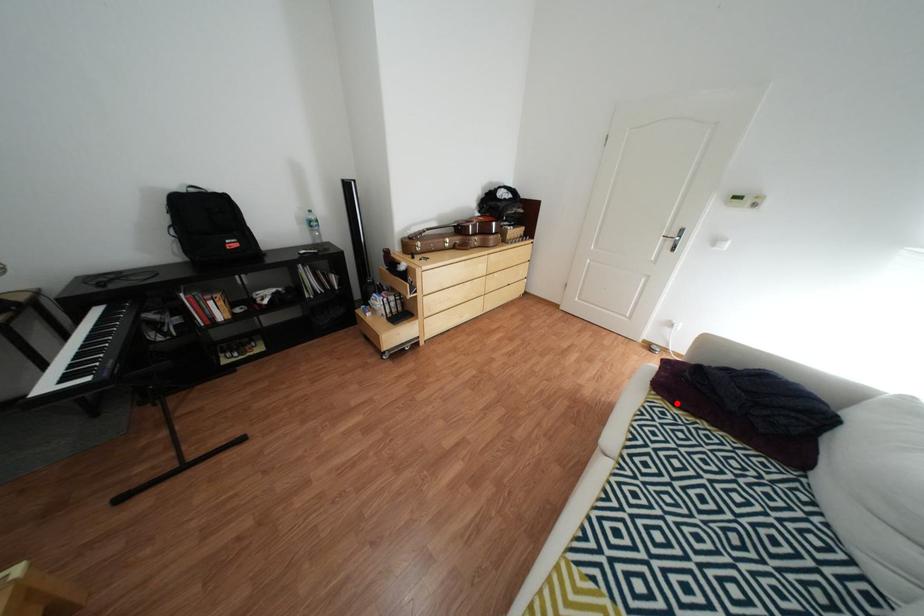
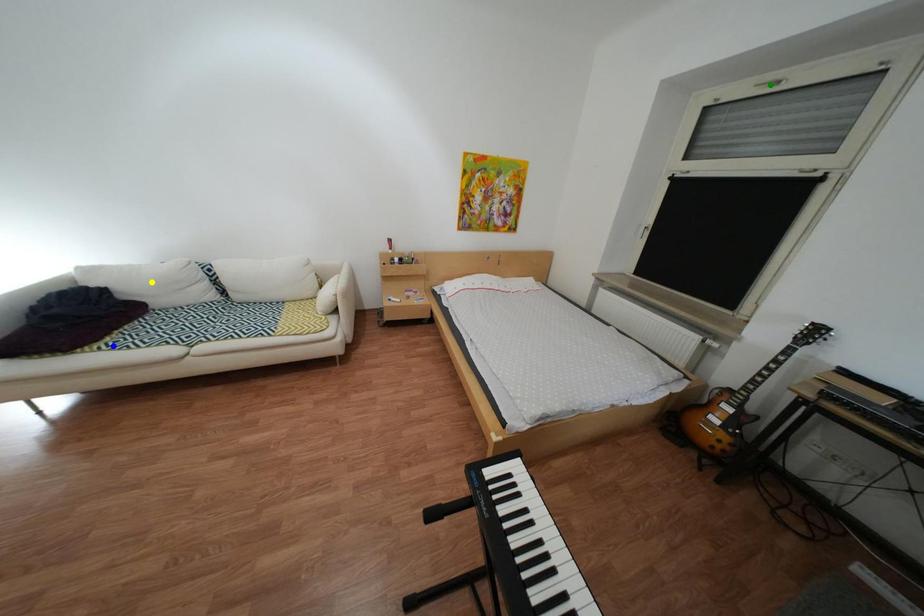
Question: I am providing you with two images of the same scene from different viewpoints. A red point is marked on the first image. You are given multiple points on the second image. Can you choose the point in image 2 that corresponds to the point in image 1?

Choices:
 (A) green point
 (B) blue point
 (C) yellow point

Answer: (B)